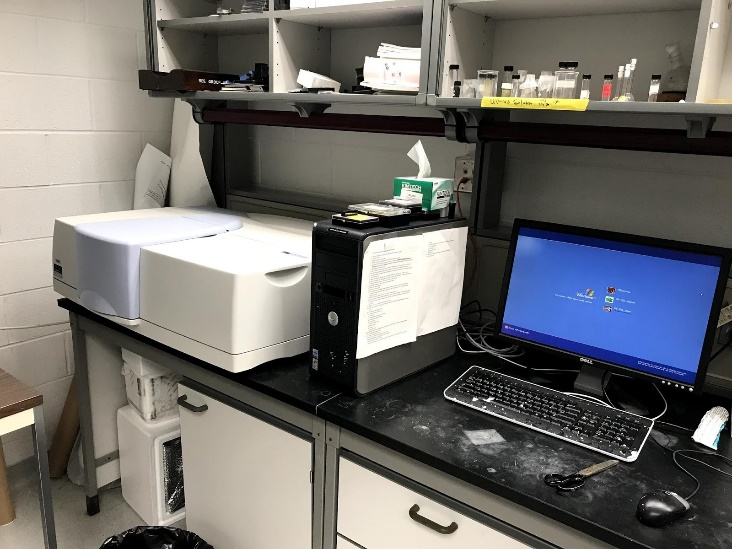
The width and height of the screenshot is (732, 549). Identify the location of wall. (307, 155), (28, 166).